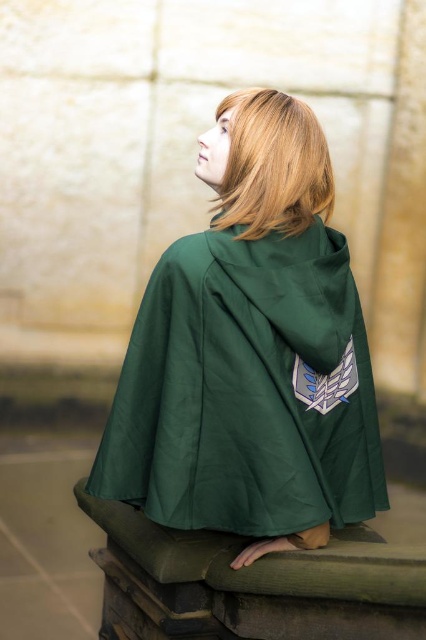
Question: Which of the following is the farthest from the observer?

Choices:
 (A) (209, 182)
 (B) (181, 364)

Answer: (A)

Question: Does green fabric cape at center have a larger size compared to blonde silky hair at upper center?

Choices:
 (A) no
 (B) yes

Answer: (B)

Question: Can you confirm if green fabric cape at center is positioned to the right of blonde silky hair at upper center?

Choices:
 (A) yes
 (B) no

Answer: (B)

Question: Is green fabric cape at center above blonde silky hair at upper center?

Choices:
 (A) yes
 (B) no

Answer: (B)